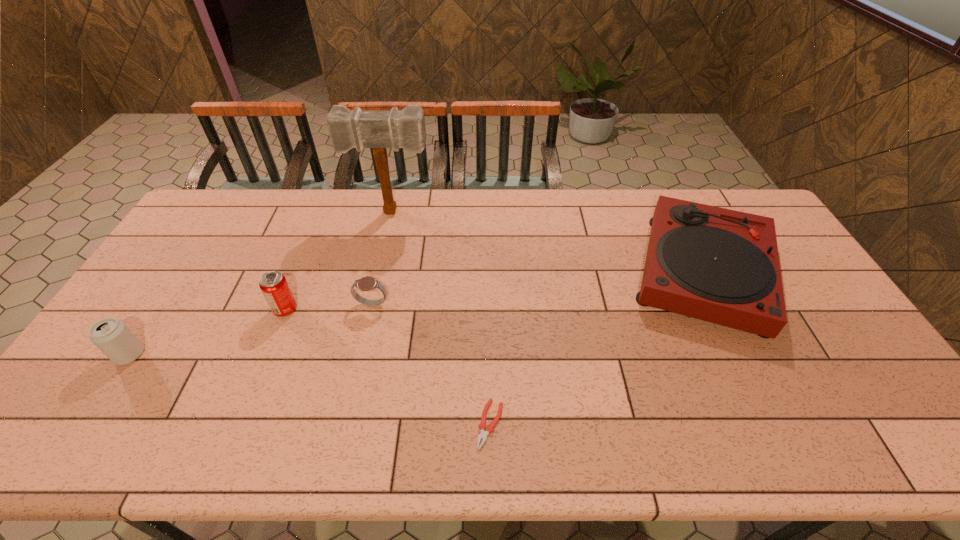
Image resolution: width=960 pixels, height=540 pixels. Find the location of `vacant space located on the right of the leftmost object`. vacant space located on the right of the leftmost object is located at coordinates [x=197, y=355].

Locate an element on the screen. This screenshot has width=960, height=540. vacant region located on the back of the second shortest object is located at coordinates (388, 233).

The height and width of the screenshot is (540, 960). I want to click on free space located 0.130m on the right of the second object from right to left, so click(559, 424).

Where is `mallet located at the far edge`? mallet located at the far edge is located at coordinates (379, 130).

Where is `record player that is at the far edge`? This screenshot has width=960, height=540. record player that is at the far edge is located at coordinates (719, 265).

The height and width of the screenshot is (540, 960). Find the location of `object that is at the near edge`. object that is at the near edge is located at coordinates (490, 429).

Where is `object that is positioned at the left edge`? The image size is (960, 540). object that is positioned at the left edge is located at coordinates (110, 335).

Locate an element on the screen. The width and height of the screenshot is (960, 540). object that is positioned at the right edge is located at coordinates (719, 265).

The width and height of the screenshot is (960, 540). What are the coordinates of `object at the far right corner` in the screenshot? It's located at [719, 265].

In the image, there is a desktop. Where is `vacant space at the far edge`? The height and width of the screenshot is (540, 960). vacant space at the far edge is located at coordinates (517, 206).